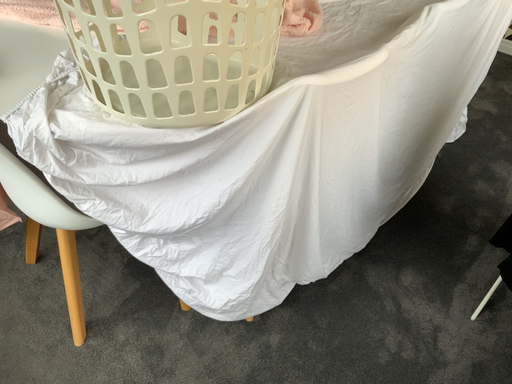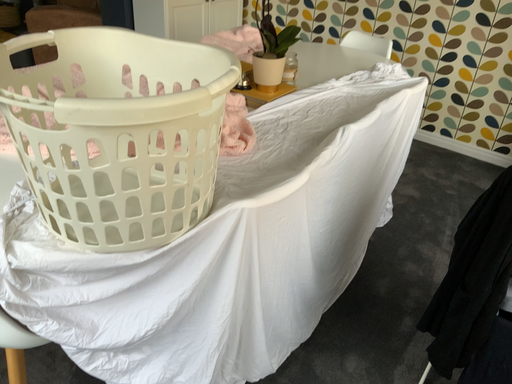
Question: Which way did the camera rotate in the video?

Choices:
 (A) rotated downward
 (B) rotated upward

Answer: (B)